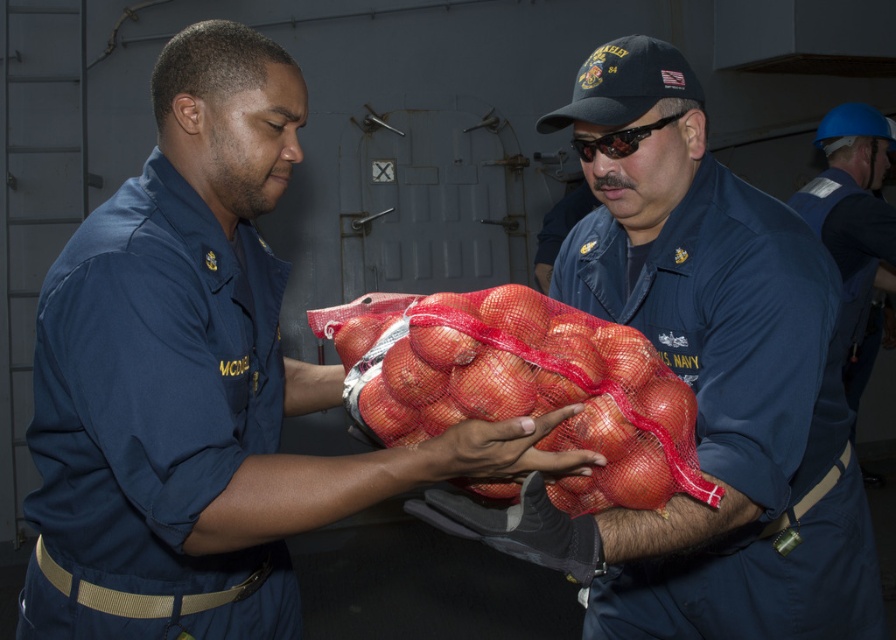
You are a photographer standing 2 meters away from the two U.S. Navy members. You want to take a photo that includes both of their uniforms in the frame. Given that your camera has a maximum focus range of 2 meters, will both the navy blue fabric uniform at left and the blue fabric uniform at center be in focus?

The navy blue fabric uniform at left and blue fabric uniform at center are 79.74 centimeters apart from each other. Since both are within the 2 meter distance from the photographer, they will both be in focus.

You are a new recruit standing at the back of the scene. You need to deliver a message to the blue fabric uniform at right, who is currently receiving onions from the blue uniform at center. Considering the distance between them, can you estimate if you can shout the message clearly without needing to walk closer?

The distance between the blue uniform at center and blue fabric uniform at right is 7.97 feet. Since shouting over distances up to 10 feet is generally possible without straining, you can likely shout the message clearly without needing to walk closer.

You are a photographer positioned at the back of the scene. You need to take a photo that includes both the blue uniform at center and the blue fabric uniform at right. Which direction should you move to ensure both are in frame?

Since the blue uniform at center is to the left of blue fabric uniform at right, you should move to the right to ensure both are in frame.